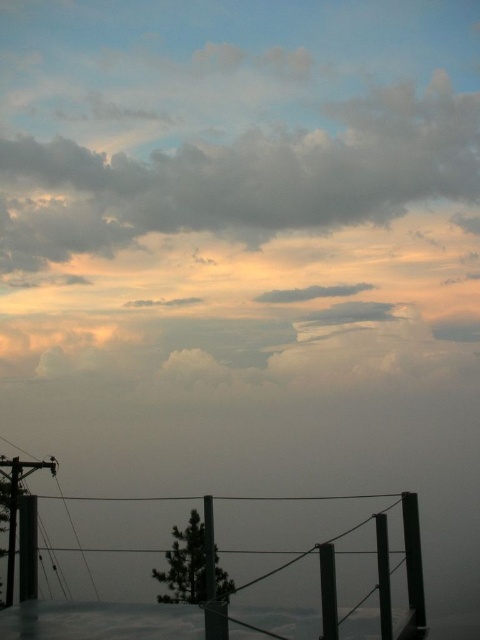
Question: Is cloudy sky at upper center wider than metallic gray telegraph pole at lower left?

Choices:
 (A) yes
 (B) no

Answer: (B)

Question: Can you confirm if metallic gray telegraph pole at lower left is smaller than black matte pole at lower right?

Choices:
 (A) yes
 (B) no

Answer: (B)

Question: Is cloudy sky at upper center in front of metallic gray telegraph pole at lower left?

Choices:
 (A) no
 (B) yes

Answer: (B)

Question: Which object appears closest to the camera in this image?

Choices:
 (A) black matte pole at lower right
 (B) cloudy sky at upper center

Answer: (A)

Question: Which object is the closest to the metallic gray telegraph pole at lower left?

Choices:
 (A) black matte pole at lower right
 (B) cloudy sky at upper center

Answer: (B)

Question: Which of the following is the farthest from the observer?

Choices:
 (A) black matte pole at lower right
 (B) cloudy sky at upper center
 (C) metallic gray telegraph pole at lower left

Answer: (C)